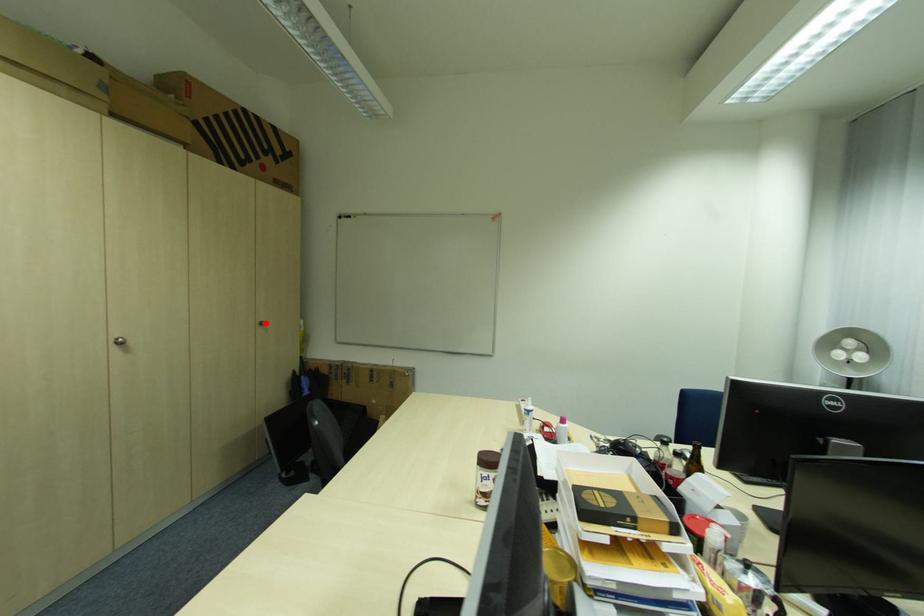
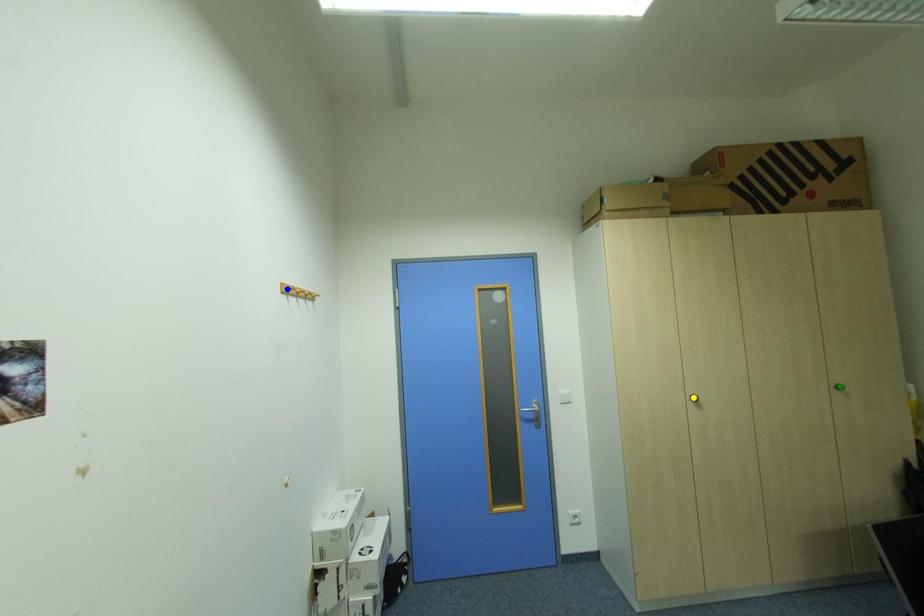
Question: I am providing you with two images of the same scene from different viewpoints. A red point is marked on the first image. You are given multiple points on the second image. Which point in image 2 represents the same 3d spot as the red point in image 1?

Choices:
 (A) yellow point
 (B) blue point
 (C) green point

Answer: (C)